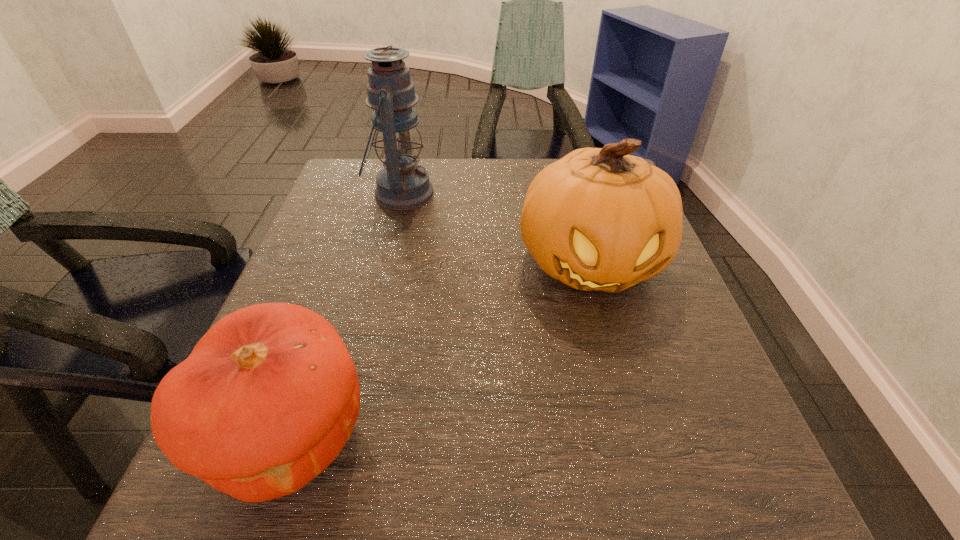
Identify the location of vacant space that is in between the shortest object and the tallest object. (346, 314).

Where is `empty space that is in between the left pumpkin and the second tallest object`? empty space that is in between the left pumpkin and the second tallest object is located at coordinates (441, 349).

Find the location of a particular element. free point between the second shortest object and the lantern is located at coordinates (495, 228).

Find the location of a particular element. This screenshot has height=540, width=960. free space between the lantern and the farther pumpkin is located at coordinates (495, 228).

Find the location of a particular element. free spot between the nearest object and the lantern is located at coordinates (346, 314).

Locate an element on the screen. Image resolution: width=960 pixels, height=540 pixels. vacant space that is in between the farthest object and the taller pumpkin is located at coordinates click(x=495, y=228).

Locate an element on the screen. This screenshot has width=960, height=540. free spot between the tallest object and the shorter pumpkin is located at coordinates (346, 314).

You are a GUI agent. You are given a task and a screenshot of the screen. Output one action in this format:
    pyautogui.click(x=<x>, y=<y>)
    Task: Click on the empty space between the nearest object and the farthest object
    
    Given the screenshot: What is the action you would take?
    pyautogui.click(x=346, y=314)

The width and height of the screenshot is (960, 540). In order to click on free space that is in between the farther pumpkin and the farthest object in this screenshot , I will do [x=495, y=228].

The height and width of the screenshot is (540, 960). What are the coordinates of `free space between the farthest object and the rightmost object` in the screenshot? It's located at pyautogui.click(x=495, y=228).